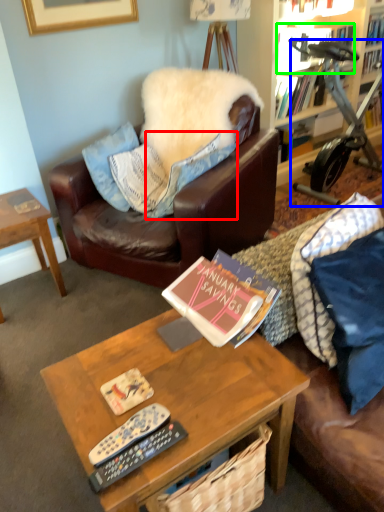
Question: Which is nearer to the pillow (highlighted by a red box)? stationary bicycle (highlighted by a blue box) or book (highlighted by a green box).

Choices:
 (A) stationary bicycle
 (B) book

Answer: (A)